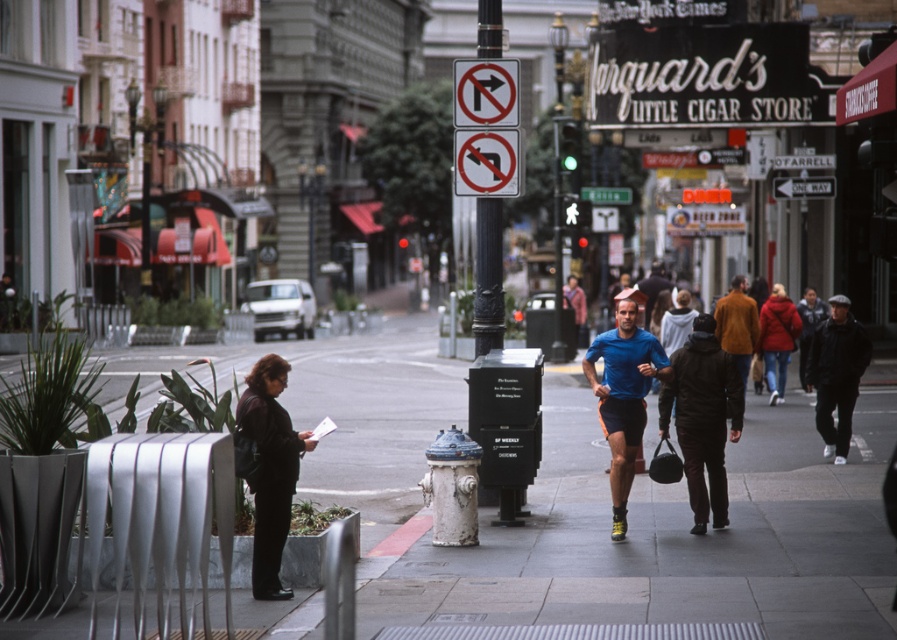
Is the position of smooth concrete sidewalk at center less distant than that of black leather jacket at lower left?

Yes, it is.

Where is `smooth concrete sidewalk at center`? The width and height of the screenshot is (897, 640). smooth concrete sidewalk at center is located at coordinates (599, 509).

Where is `smooth concrete sidewalk at center`? smooth concrete sidewalk at center is located at coordinates (599, 509).